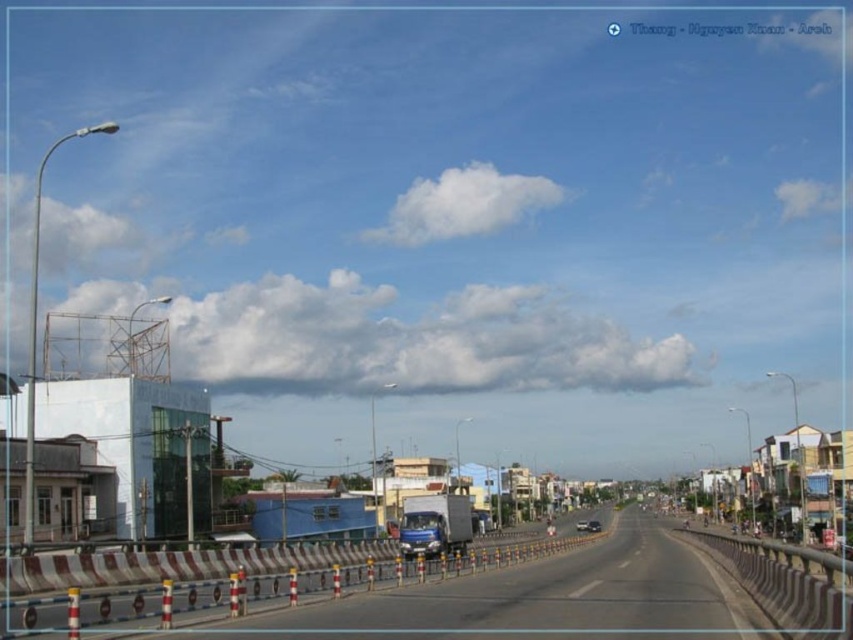
Question: Is white plastic barrier at center bigger than metallic gray barrier at lower right?

Choices:
 (A) yes
 (B) no

Answer: (A)

Question: Can you confirm if metallic gray barrier at lower right is bigger than metallic silver car at center?

Choices:
 (A) no
 (B) yes

Answer: (B)

Question: Is white plastic barrier at center below metallic silver sedan at center?

Choices:
 (A) yes
 (B) no

Answer: (B)

Question: Which point appears closest to the camera in this image?

Choices:
 (A) (360, 582)
 (B) (799, 570)

Answer: (B)

Question: Which point is farther to the camera?

Choices:
 (A) (834, 586)
 (B) (380, 572)
 (C) (579, 520)
 (D) (590, 528)

Answer: (C)

Question: Which object is farther from the camera taking this photo?

Choices:
 (A) metallic gray barrier at lower right
 (B) metallic silver car at center
 (C) white plastic barrier at center

Answer: (B)